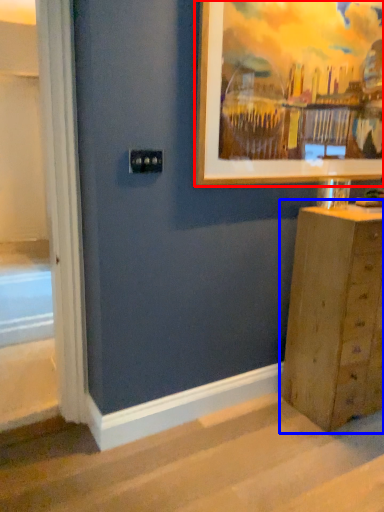
Question: Which point is further to the camera, picture frame (highlighted by a red box) or chest of drawers (highlighted by a blue box)?

Choices:
 (A) picture frame
 (B) chest of drawers

Answer: (B)